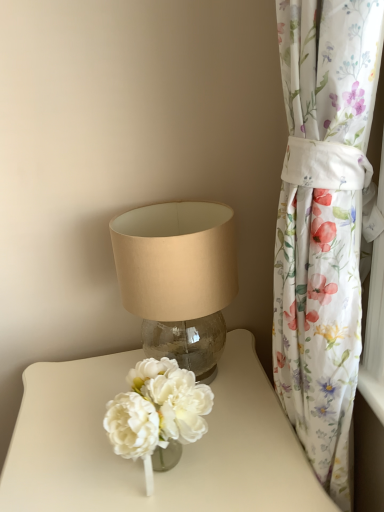
Image resolution: width=384 pixels, height=512 pixels. What do you see at coordinates (139, 459) in the screenshot?
I see `translucent glass vase at center` at bounding box center [139, 459].

The image size is (384, 512). What do you see at coordinates (178, 278) in the screenshot?
I see `beige fabric lampshade at center` at bounding box center [178, 278].

Where is `beige fabric lampshade at center`? beige fabric lampshade at center is located at coordinates (178, 278).

You are a GUI agent. You are given a task and a screenshot of the screen. Output one action in this format:
    pyautogui.click(x=<x>, y=<y>)
    Task: Click on the translucent glass vase at center
    This screenshot has width=384, height=512.
    Given the screenshot: What is the action you would take?
    pyautogui.click(x=139, y=459)

Are translucent glass vase at center and floral fabric curtain at right beside each other?

No, translucent glass vase at center is not making contact with floral fabric curtain at right.

Consider the image. Is translucent glass vase at center oriented towards floral fabric curtain at right?

No, translucent glass vase at center is not aimed at floral fabric curtain at right.

How far apart are translucent glass vase at center and floral fabric curtain at right?

They are 13.25 inches apart.

From the image's perspective, is translucent glass vase at center located above or below floral fabric curtain at right?

translucent glass vase at center is below floral fabric curtain at right.

Is floral fabric curtain at right thinner than beige fabric lampshade at center?

Yes, floral fabric curtain at right is thinner than beige fabric lampshade at center.

Is floral fabric curtain at right closer to the viewer compared to beige fabric lampshade at center?

Yes, the depth of floral fabric curtain at right is less than that of beige fabric lampshade at center.

Is the surface of floral fabric curtain at right in direct contact with beige fabric lampshade at center?

No, floral fabric curtain at right is not with beige fabric lampshade at center.

Where is `lamp located behind the floral fabric curtain at right`? lamp located behind the floral fabric curtain at right is located at coordinates (178, 278).

Can you tell me how much beige fabric lampshade at center and translucent glass vase at center differ in facing direction?

beige fabric lampshade at center and translucent glass vase at center are facing 0.111 degrees away from each other.

Considering the relative positions of beige fabric lampshade at center and translucent glass vase at center in the image provided, is beige fabric lampshade at center behind translucent glass vase at center?

Yes, beige fabric lampshade at center is behind translucent glass vase at center.

From a real-world perspective, is beige fabric lampshade at center on top of translucent glass vase at center?

Indeed, from a real-world perspective, beige fabric lampshade at center stands above translucent glass vase at center.

Based on the photo, considering the relative sizes of beige fabric lampshade at center and floral fabric curtain at right in the image provided, is beige fabric lampshade at center bigger than floral fabric curtain at right?

Indeed, beige fabric lampshade at center has a larger size compared to floral fabric curtain at right.

From the image's perspective, which is below, beige fabric lampshade at center or floral fabric curtain at right?

From the image's view, floral fabric curtain at right is below.

Considering the relative positions of beige fabric lampshade at center and floral fabric curtain at right in the image provided, is beige fabric lampshade at center behind floral fabric curtain at right?

Yes, beige fabric lampshade at center is further from the camera.

Considering the positions of point (196, 367) and point (322, 335), is point (196, 367) closer or farther from the camera than point (322, 335)?

Point (196, 367) is positioned farther from the camera compared to point (322, 335).

Would you consider floral fabric curtain at right to be distant from translucent glass vase at center?

floral fabric curtain at right is actually quite close to translucent glass vase at center.

Which is correct: floral fabric curtain at right is inside translucent glass vase at center, or outside of it?

floral fabric curtain at right exists entirely within translucent glass vase at center.

Considering the relative positions of floral fabric curtain at right and translucent glass vase at center in the image provided, is floral fabric curtain at right to the left or to the right of translucent glass vase at center?

From the image, it's evident that floral fabric curtain at right is to the right of translucent glass vase at center.

Where is `table on the left of beige fabric lampshade at center`? Image resolution: width=384 pixels, height=512 pixels. table on the left of beige fabric lampshade at center is located at coordinates (139, 459).

Does translucent glass vase at center touch beige fabric lampshade at center?

There is a gap between translucent glass vase at center and beige fabric lampshade at center.

Based on the photo, which of these two, translucent glass vase at center or beige fabric lampshade at center, is thinner?

Thinner between the two is beige fabric lampshade at center.

Which of these two, translucent glass vase at center or beige fabric lampshade at center, is bigger?

Bigger between the two is translucent glass vase at center.

At what (x,y) coordinates should I click in order to perform the action: click on table behind the floral fabric curtain at right. Please return your answer as a coordinate pair (x, y). Image resolution: width=384 pixels, height=512 pixels. Looking at the image, I should click on (139, 459).

At what (x,y) coordinates should I click in order to perform the action: click on lamp to the left of floral fabric curtain at right. Please return your answer as a coordinate pair (x, y). Image resolution: width=384 pixels, height=512 pixels. Looking at the image, I should click on (178, 278).

From the image, which object appears to be farther from floral fabric curtain at right, beige fabric lampshade at center or translucent glass vase at center?

Among the two, translucent glass vase at center is located further to floral fabric curtain at right.

When comparing their distances from beige fabric lampshade at center, does translucent glass vase at center or floral fabric curtain at right seem further?

floral fabric curtain at right is further to beige fabric lampshade at center.

From the image, which object appears to be nearer to translucent glass vase at center, floral fabric curtain at right or beige fabric lampshade at center?

beige fabric lampshade at center lies closer to translucent glass vase at center than the other object.

From the picture: Considering their positions, is floral fabric curtain at right positioned further to beige fabric lampshade at center than translucent glass vase at center?

Based on the image, floral fabric curtain at right appears to be further to beige fabric lampshade at center.

Based on the photo, estimate the real-world distances between objects in this image. Which object is further from floral fabric curtain at right, translucent glass vase at center or beige fabric lampshade at center?

translucent glass vase at center lies further to floral fabric curtain at right than the other object.

Looking at the image, which one is located closer to translucent glass vase at center, beige fabric lampshade at center or floral fabric curtain at right?

Among the two, beige fabric lampshade at center is located nearer to translucent glass vase at center.

At what (x,y) coordinates should I click in order to perform the action: click on curtain that lies between beige fabric lampshade at center and translucent glass vase at center from top to bottom. Please return your answer as a coordinate pair (x, y). Looking at the image, I should click on (323, 221).